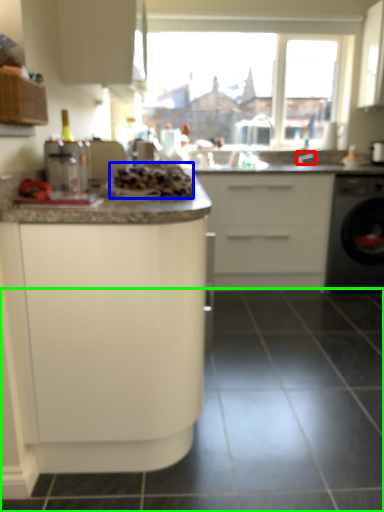
Question: Considering the real-world distances, which object is closest to faucet (highlighted by a red box)? food (highlighted by a blue box) or tile (highlighted by a green box).

Choices:
 (A) food
 (B) tile

Answer: (A)